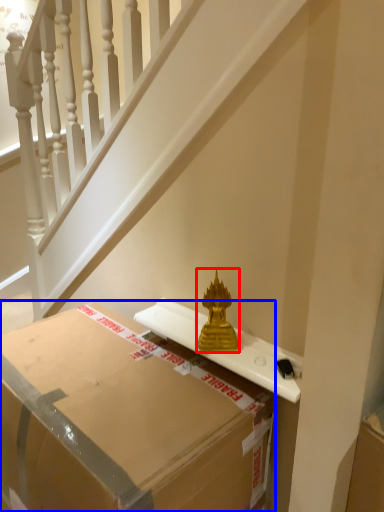
Question: Which of the following is the closest to the observer, sculpture (highlighted by a red box) or box (highlighted by a blue box)?

Choices:
 (A) sculpture
 (B) box

Answer: (B)